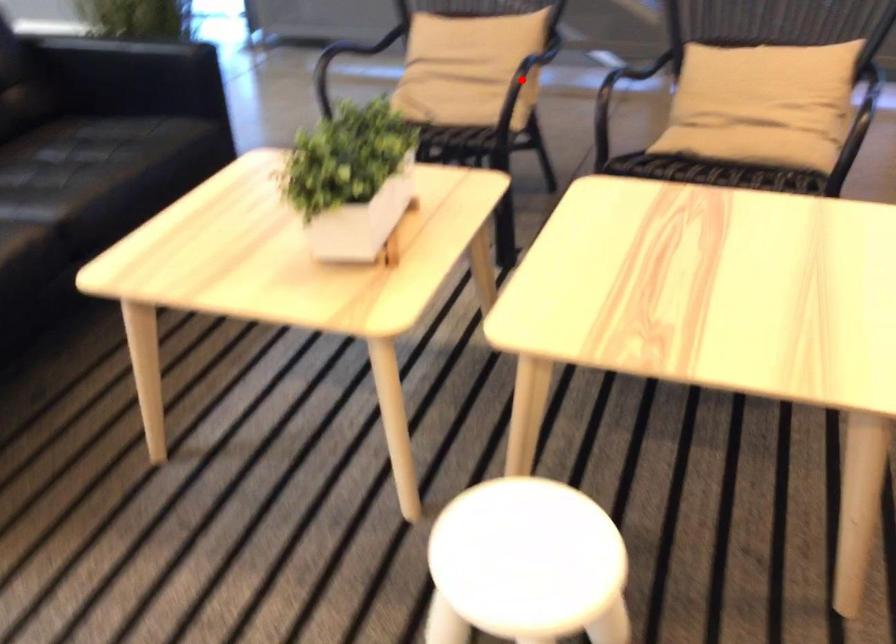
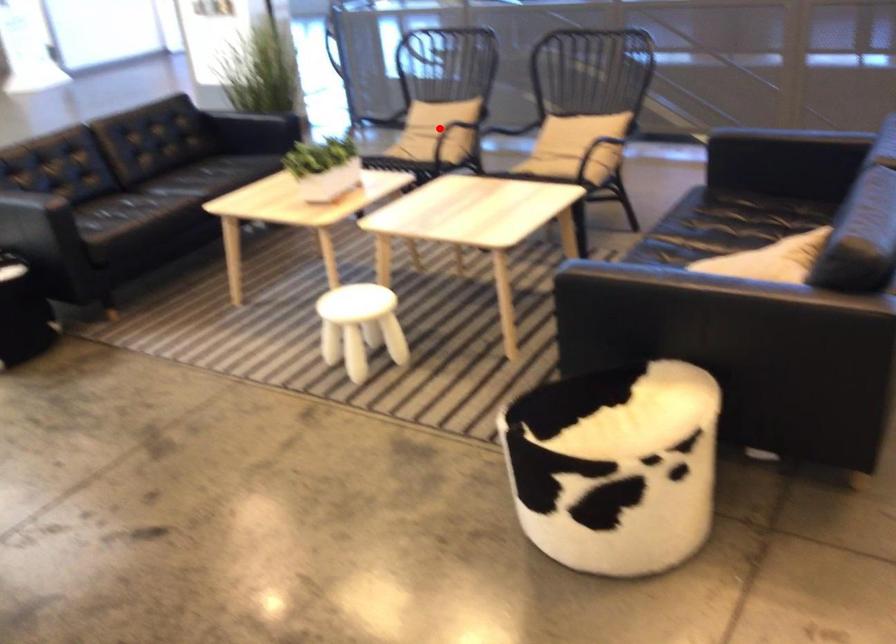
I am providing you with two images of the same scene from different viewpoints. A red point is marked on the first image and another point is marked on the second image. Does the point marked in image1 correspond to the same location as the one in image2?

Yes